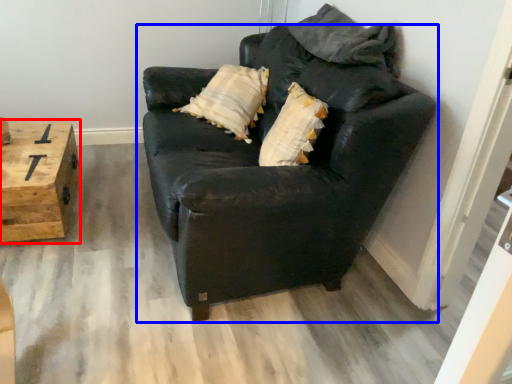
Question: Which of the following is the closest to the observer, table (highlighted by a red box) or studio couch (highlighted by a blue box)?

Choices:
 (A) table
 (B) studio couch

Answer: (B)